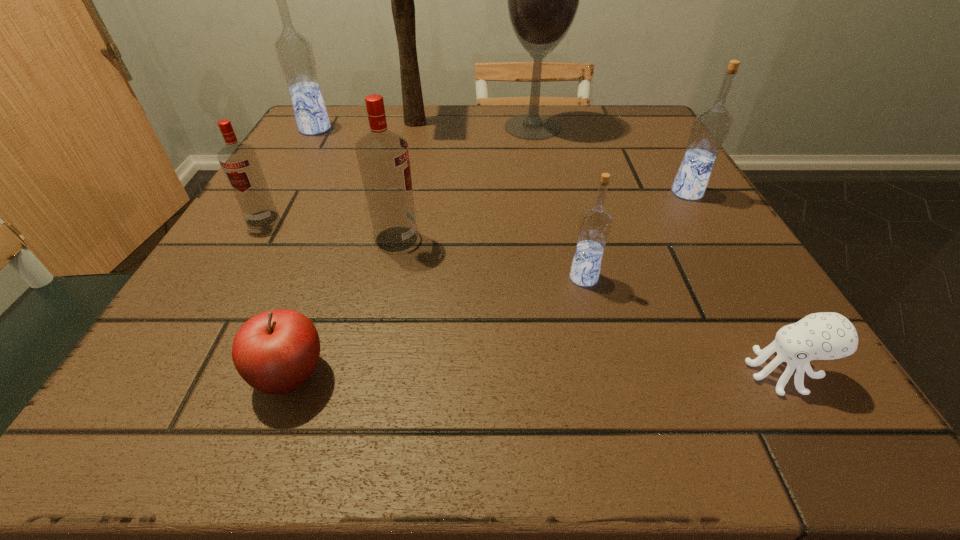
Locate an element on the screen. free space located on the back of the smallest blue vodka is located at coordinates (552, 145).

This screenshot has height=540, width=960. I want to click on free space located on the front-facing side of the octopus, so coord(699,372).

At what (x,y) coordinates should I click in order to perform the action: click on vacant region located 0.400m on the front-facing side of the octopus. Please return your answer as a coordinate pair (x, y). The image size is (960, 540). Looking at the image, I should click on (428, 372).

This screenshot has width=960, height=540. What are the coordinates of `vacant space situated on the front-facing side of the octopus` in the screenshot? It's located at (500, 372).

Where is `free space located 0.180m on the right of the third object from left to right`? The height and width of the screenshot is (540, 960). free space located 0.180m on the right of the third object from left to right is located at coordinates (472, 375).

Where is `mallet at the far edge`? The width and height of the screenshot is (960, 540). mallet at the far edge is located at coordinates (402, 0).

Locate an element on the screen. Image resolution: width=960 pixels, height=540 pixels. alcohol that is at the far edge is located at coordinates point(542,0).

Find the location of `vodka that is positioned at the far edge`. vodka that is positioned at the far edge is located at coordinates (294, 51).

Where is `octopus that is at the near edge`? octopus that is at the near edge is located at coordinates (827, 335).

This screenshot has height=540, width=960. Find the location of `apple present at the near edge`. apple present at the near edge is located at coordinates (275, 352).